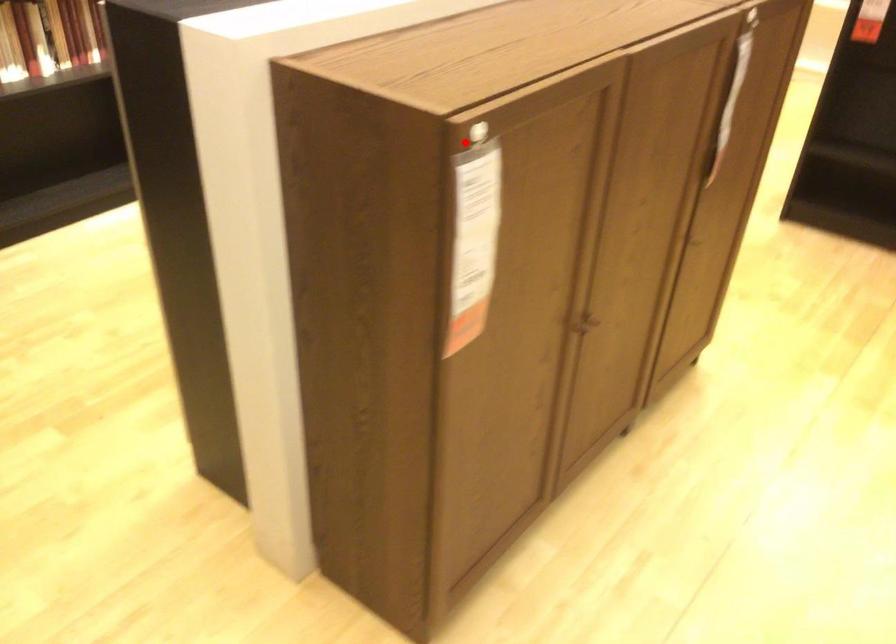
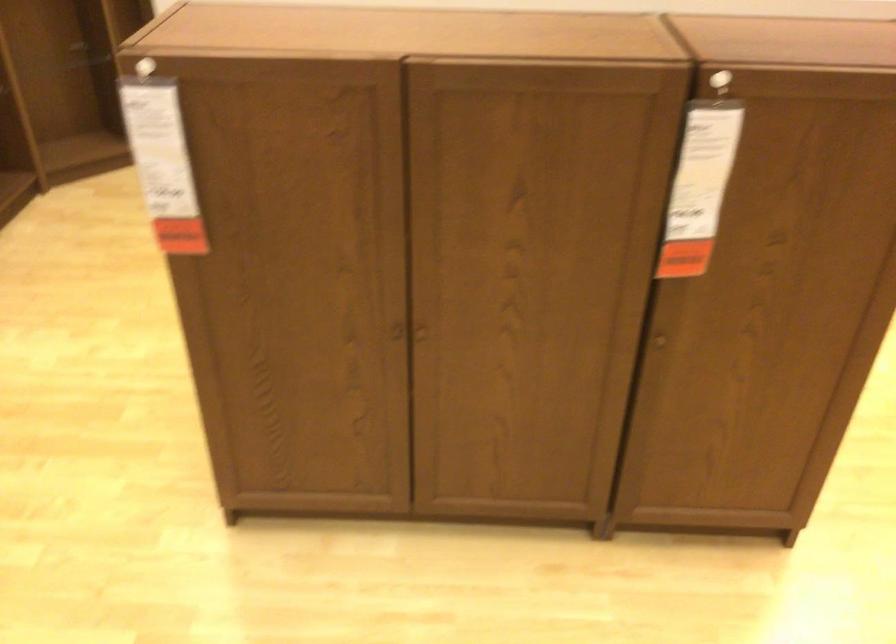
Locate, in the second image, the point that corresponds to the highlighted location in the first image.

(143, 67)